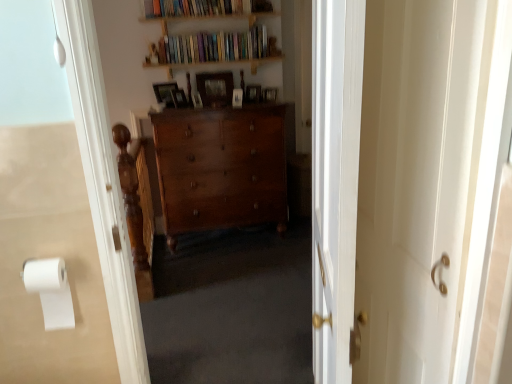
Find the location of a particular element. The width and height of the screenshot is (512, 384). free spot in front of polished wood dresser at center is located at coordinates (221, 279).